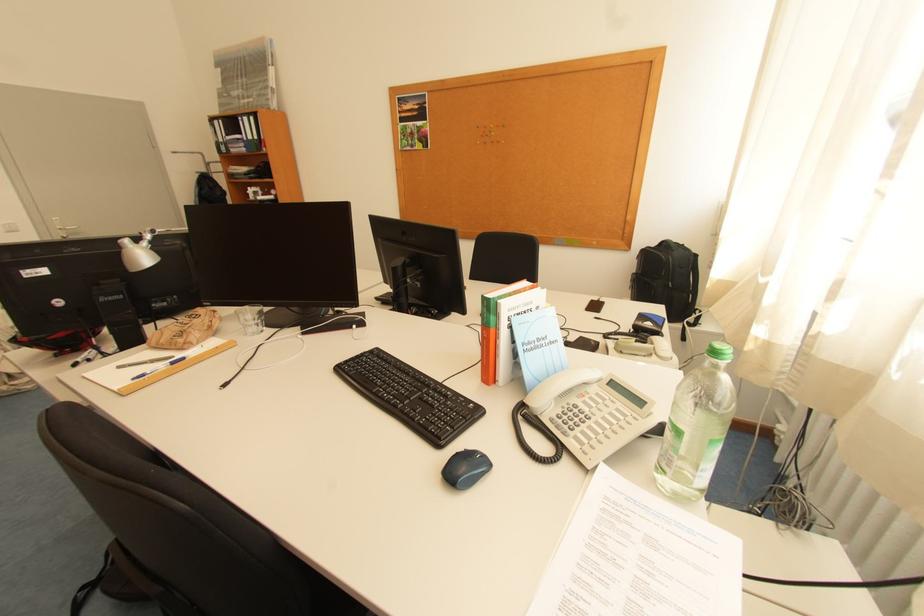
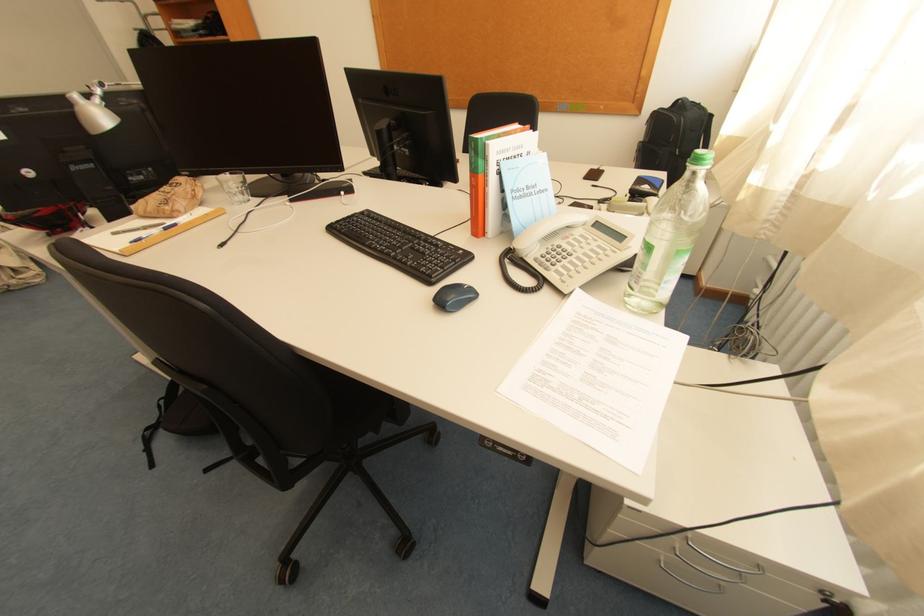
Find the pixel in the second image that matches point 450,476 in the first image.

(441, 304)